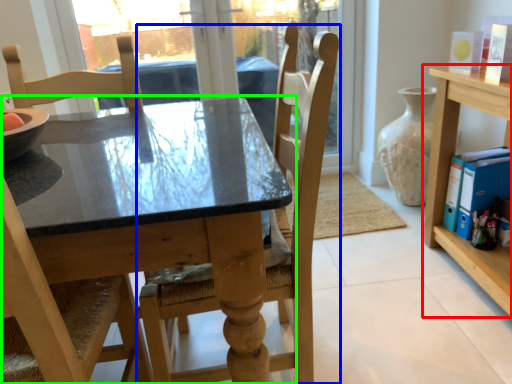
Question: Considering the real-world distances, which object is closest to shelf (highlighted by a red box)? chair (highlighted by a blue box) or table (highlighted by a green box).

Choices:
 (A) chair
 (B) table

Answer: (A)